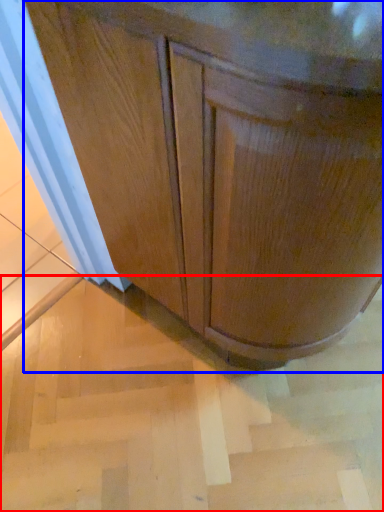
Question: Which of the following is the closest to the observer, stair (highlighted by a red box) or cabinetry (highlighted by a blue box)?

Choices:
 (A) stair
 (B) cabinetry

Answer: (B)